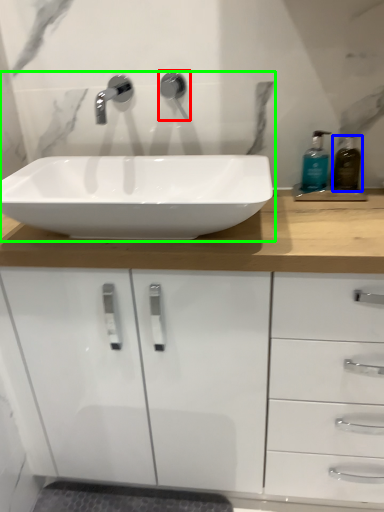
Question: Estimate the real-world distances between objects in this image. Which object is farther from plumbing fixture (highlighted by a red box), soap dispenser (highlighted by a blue box) or sink (highlighted by a green box)?

Choices:
 (A) soap dispenser
 (B) sink

Answer: (A)